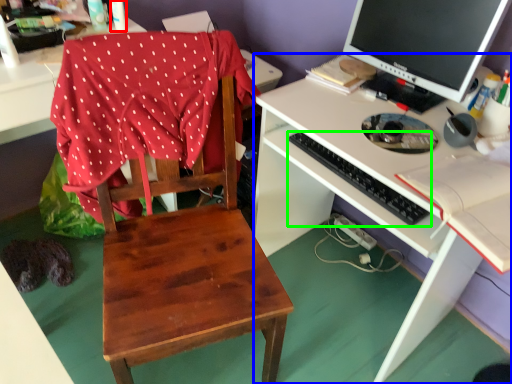
Question: Which is farther away from bottle (highlighted by a red box)? desk (highlighted by a blue box) or computer keyboard (highlighted by a green box)?

Choices:
 (A) desk
 (B) computer keyboard

Answer: (A)